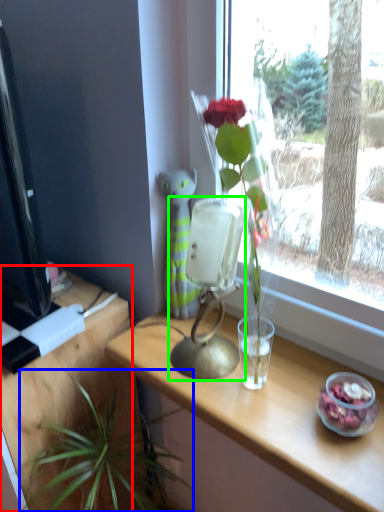
Question: Which object is positioned farthest from table (highlighted by a red box)? Select from houseplant (highlighted by a blue box) and table lamp (highlighted by a green box).

Choices:
 (A) houseplant
 (B) table lamp

Answer: (B)